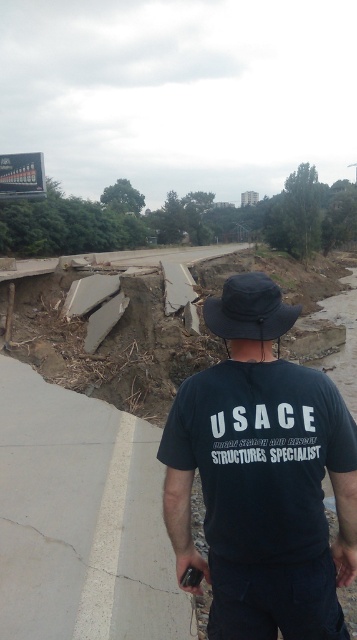
You are a rescue worker trying to reach the gray concrete pavement at lower left from your current position near the dark blue cotton shirt at center. Can you safely walk directly to it without stepping on any unstable ground? Explain your reasoning based on the distance between them.

The dark blue cotton shirt at center and gray concrete pavement at lower left are 7.56 feet apart. Since the distance is relatively short, you can safely walk directly to the gray concrete pavement at lower left without stepping on unstable ground, assuming the path between them is clear of debris or hazards as described in the scene.

You are a rescue worker assessing the damaged road. You notice the dark blue cotton shirt at center and the gray concrete pavement at lower left. Which object is positioned to the right of the other?

The dark blue cotton shirt at center is to the right of the gray concrete pavement at lower left.

You are an engineer assessing the road damage. You notice the gray concrete pavement at lower left and the black fabric baseball hat at center. Which object is smaller in size?

The gray concrete pavement at lower left has a smaller size compared to the black fabric baseball hat at center.